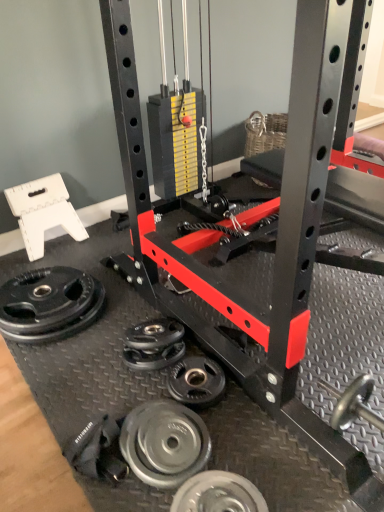
Question: Is silver metallic weight plate at lower center, which ranks as the first wheel in front-to-back order, turned away from black rubber weight plate at lower left, marked as the 1th wheel in a top-to-bottom arrangement?

Choices:
 (A) no
 (B) yes

Answer: (B)

Question: From a real-world perspective, is silver metallic weight plate at lower center, which appears as the 1th wheel when viewed from the right, positioned over black rubber weight plate at lower left, which is the first wheel in back-to-front order, based on gravity?

Choices:
 (A) no
 (B) yes

Answer: (A)

Question: Considering the relative sizes of silver metallic weight plate at lower center, which appears as the 4th wheel when viewed from the back, and black rubber weight plate at lower left, which ranks as the 4th wheel in bottom-to-top order, in the image provided, is silver metallic weight plate at lower center, which appears as the 4th wheel when viewed from the back, taller than black rubber weight plate at lower left, which ranks as the 4th wheel in bottom-to-top order,?

Choices:
 (A) yes
 (B) no

Answer: (B)

Question: From the image's perspective, does silver metallic weight plate at lower center, which ranks as the first wheel in front-to-back order, appear higher than black rubber weight plate at lower left, which ranks as the fourth wheel in front-to-back order?

Choices:
 (A) yes
 (B) no

Answer: (B)

Question: From a real-world perspective, is silver metallic weight plate at lower center, which appears as the 1th wheel when viewed from the right, located beneath black rubber weight plate at lower left, which is the first wheel in back-to-front order?

Choices:
 (A) no
 (B) yes

Answer: (B)

Question: From the image's perspective, is black rubber weight plate at lower left, which appears as the fourth wheel when viewed from the right, above or below silver metallic weight plate at lower center, which is counted as the 2th wheel, starting from the left?

Choices:
 (A) above
 (B) below

Answer: (A)

Question: Is black rubber weight plate at lower left, which appears as the fourth wheel when viewed from the right, taller or shorter than silver metallic weight plate at lower center, which ranks as the second wheel in front-to-back order?

Choices:
 (A) tall
 (B) short

Answer: (B)

Question: From a real-world perspective, relative to silver metallic weight plate at lower center, which is counted as the 2th wheel, starting from the left, is black rubber weight plate at lower left, which is the first wheel in back-to-front order, vertically above or below?

Choices:
 (A) below
 (B) above

Answer: (A)

Question: Would you say black rubber weight plate at lower left, which ranks as the fourth wheel in front-to-back order, is to the left or to the right of silver metallic weight plate at lower center, which is counted as the third wheel, starting from the right, in the picture?

Choices:
 (A) right
 (B) left

Answer: (B)

Question: Is point (187, 390) closer or farther from the camera than point (188, 505)?

Choices:
 (A) farther
 (B) closer

Answer: (A)

Question: Visually, is silver metallic weight plate at lower center, acting as the 2th wheel starting from the right, positioned to the left or to the right of silver metallic weight plate at lower center, which appears as the 1th wheel when viewed from the right?

Choices:
 (A) left
 (B) right

Answer: (A)

Question: From a real-world perspective, is silver metallic weight plate at lower center, marked as the third wheel in a bottom-to-top arrangement, above or below silver metallic weight plate at lower center, which appears as the 4th wheel when viewed from the back?

Choices:
 (A) below
 (B) above

Answer: (A)

Question: Is silver metallic weight plate at lower center, the third wheel from the left, in front of or behind silver metallic weight plate at lower center, the 4th wheel positioned from the left, in the image?

Choices:
 (A) front
 (B) behind

Answer: (B)

Question: From the image's perspective, is silver metallic weight plate at lower center, which ranks as the first wheel in front-to-back order, above or below silver metallic weight plate at lower center, which ranks as the 2th wheel in back-to-front order?

Choices:
 (A) above
 (B) below

Answer: (B)

Question: Relative to silver metallic weight plate at lower center, acting as the 2th wheel starting from the right, is silver metallic weight plate at lower center, the fourth wheel in the top-to-bottom sequence, in front or behind?

Choices:
 (A) front
 (B) behind

Answer: (A)